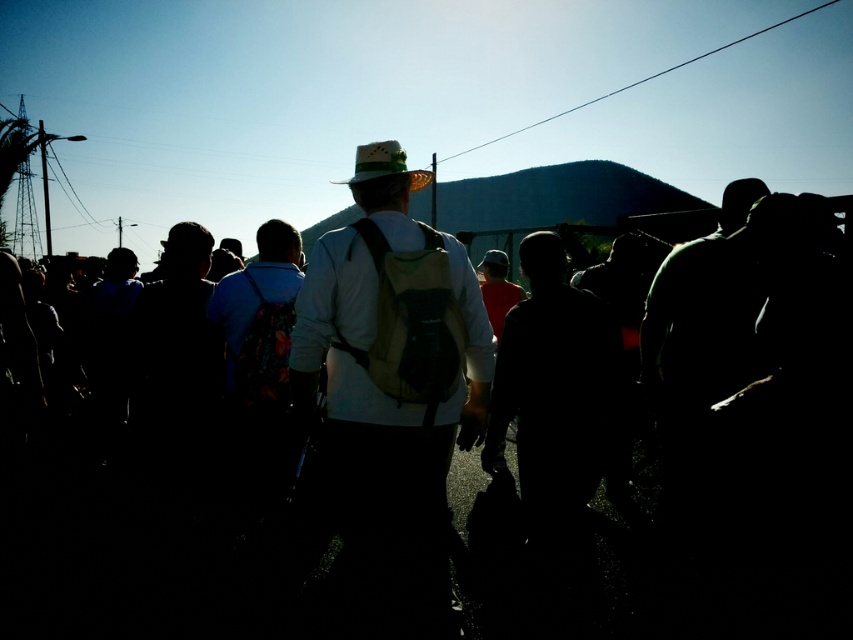
Question: Is silhouette crowd at center below green felt cowboy hat at center?

Choices:
 (A) yes
 (B) no

Answer: (A)

Question: Is silhouette crowd at center to the left of green felt cowboy hat at center from the viewer's perspective?

Choices:
 (A) no
 (B) yes

Answer: (A)

Question: Which point is closer to the camera taking this photo?

Choices:
 (A) (408, 534)
 (B) (401, 164)

Answer: (B)

Question: Which object appears closest to the camera in this image?

Choices:
 (A) green felt cowboy hat at center
 (B) white matte shirt at center
 (C) silhouette crowd at center

Answer: (B)

Question: Can you confirm if silhouette crowd at center is positioned below white matte shirt at center?

Choices:
 (A) yes
 (B) no

Answer: (A)

Question: Which of the following is the closest to the observer?

Choices:
 (A) green felt cowboy hat at center
 (B) white matte shirt at center

Answer: (B)